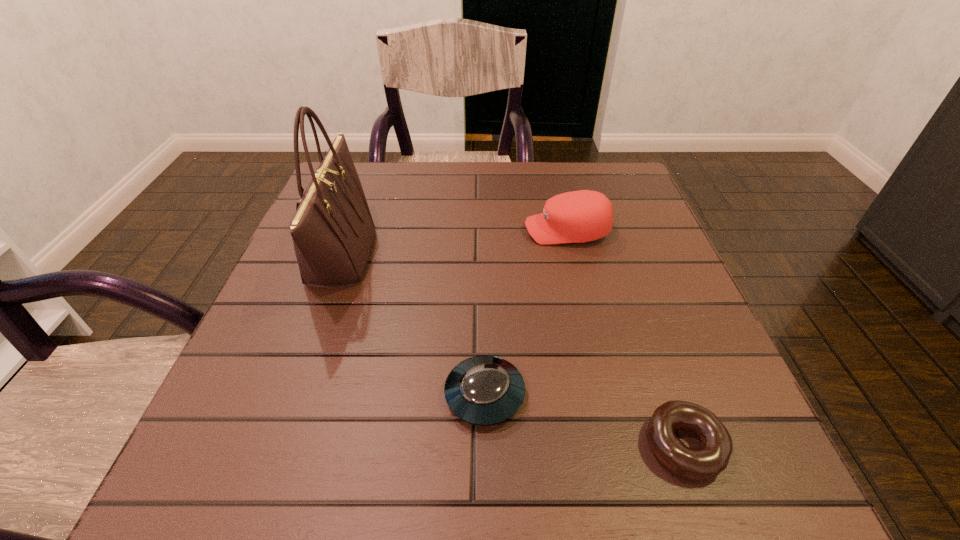
Locate an element on the screen. This screenshot has height=540, width=960. blank space located on the left of the doughnut is located at coordinates (420, 445).

This screenshot has height=540, width=960. I want to click on object that is at the far edge, so click(x=333, y=232).

Locate an element on the screen. object present at the near edge is located at coordinates (707, 462).

At what (x,y) coordinates should I click in order to perform the action: click on object located at the left edge. Please return your answer as a coordinate pair (x, y). Looking at the image, I should click on (333, 232).

What are the coordinates of `cap present at the right edge` in the screenshot? It's located at (581, 216).

The image size is (960, 540). I want to click on doughnut that is at the right edge, so click(707, 462).

Where is `object at the far left corner`? This screenshot has height=540, width=960. object at the far left corner is located at coordinates (333, 232).

Locate an element on the screen. This screenshot has width=960, height=540. object that is at the near right corner is located at coordinates (707, 462).

In the image, there is a desktop. Where is `vacant space at the far edge`? Image resolution: width=960 pixels, height=540 pixels. vacant space at the far edge is located at coordinates (451, 176).

Find the location of `vacant space at the left edge`. vacant space at the left edge is located at coordinates (299, 268).